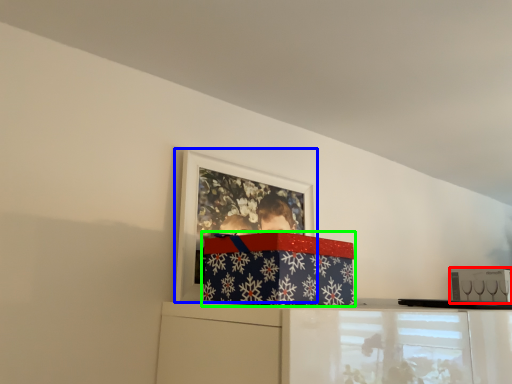
Question: Which object is the closest to the box (highlighted by a red box)? Choose among these: picture frame (highlighted by a blue box) or package (highlighted by a green box).

Choices:
 (A) picture frame
 (B) package

Answer: (A)